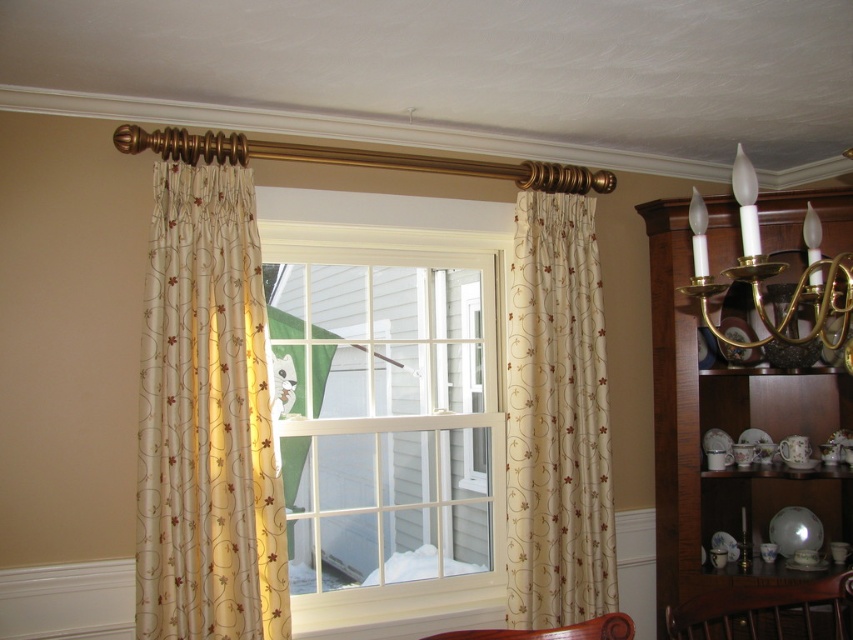
Question: Considering the real-world distances, which object is closest to the brown wood chair at lower center?

Choices:
 (A) gold embroidered curtain at center
 (B) beige floral fabric curtain at right

Answer: (A)

Question: Which object appears closest to the camera in this image?

Choices:
 (A) brown wood chair at lower center
 (B) gold brass chandelier at upper right
 (C) mahogany wood chair at lower right

Answer: (B)

Question: Can you confirm if white glass window at center is positioned below gold brass chandelier at upper right?

Choices:
 (A) no
 (B) yes

Answer: (B)

Question: Does beige floral fabric curtain at right appear over brown wood chair at lower center?

Choices:
 (A) no
 (B) yes

Answer: (B)

Question: Observing the image, what is the correct spatial positioning of gold embroidered curtain at center in reference to mahogany wood chair at lower right?

Choices:
 (A) above
 (B) below

Answer: (A)

Question: Among these points, which one is nearest to the camera?

Choices:
 (A) (244, 579)
 (B) (531, 570)

Answer: (A)